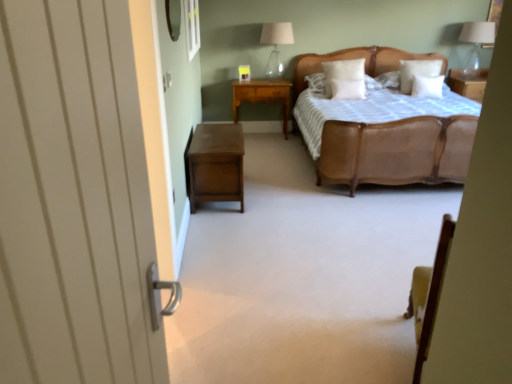
You are a GUI agent. You are given a task and a screenshot of the screen. Output one action in this format:
    pyautogui.click(x=<x>, y=<y>)
    Task: Click on the vacant space in front of brown wood nightstand at lower left, acting as the 2th nightstand starting from the back
    
    Given the screenshot: What is the action you would take?
    pyautogui.click(x=246, y=226)